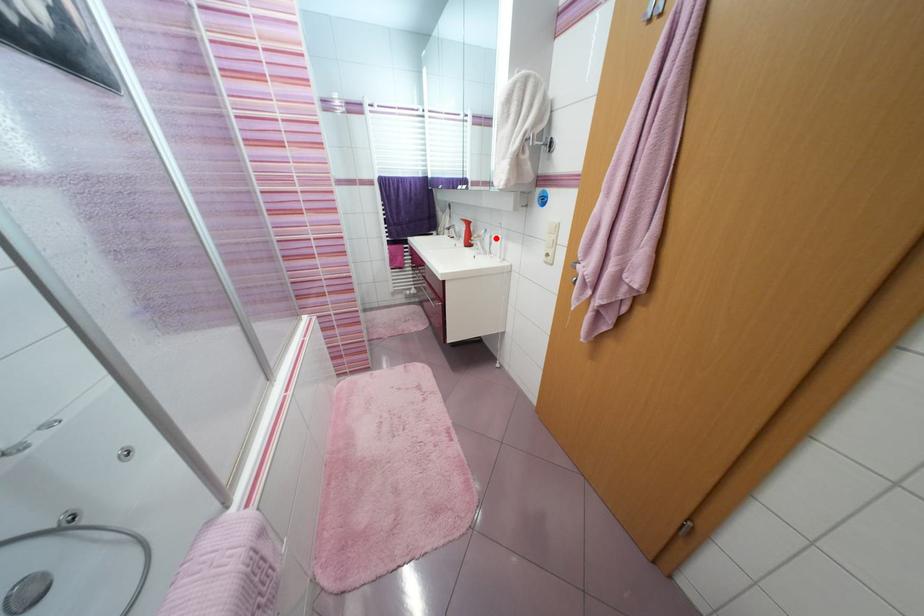
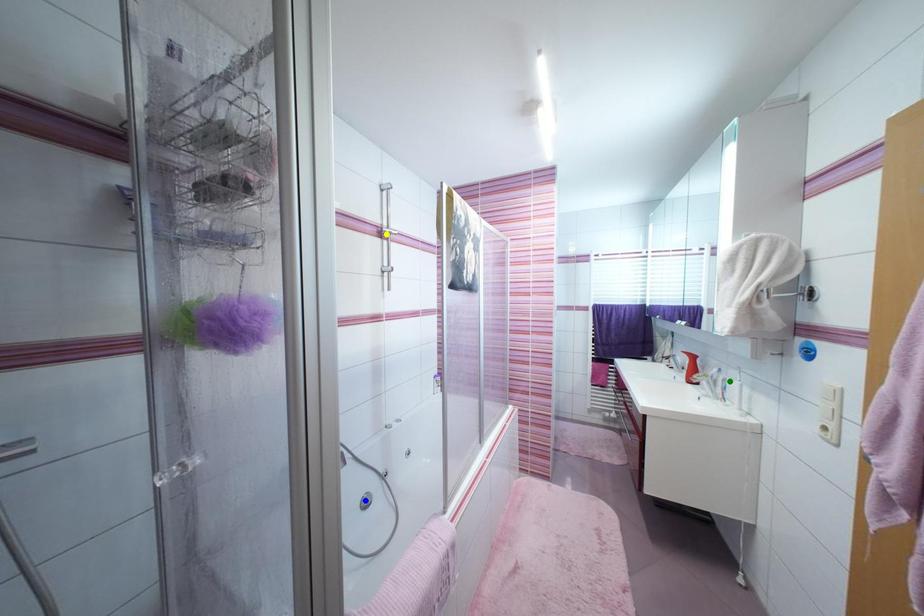
Question: I am providing you with two images of the same scene from different viewpoints. A red point is marked on the first image. You are given multiple points on the second image. Which spot in image 2 lines up with the point in image 1?

Choices:
 (A) yellow point
 (B) blue point
 (C) green point

Answer: (C)